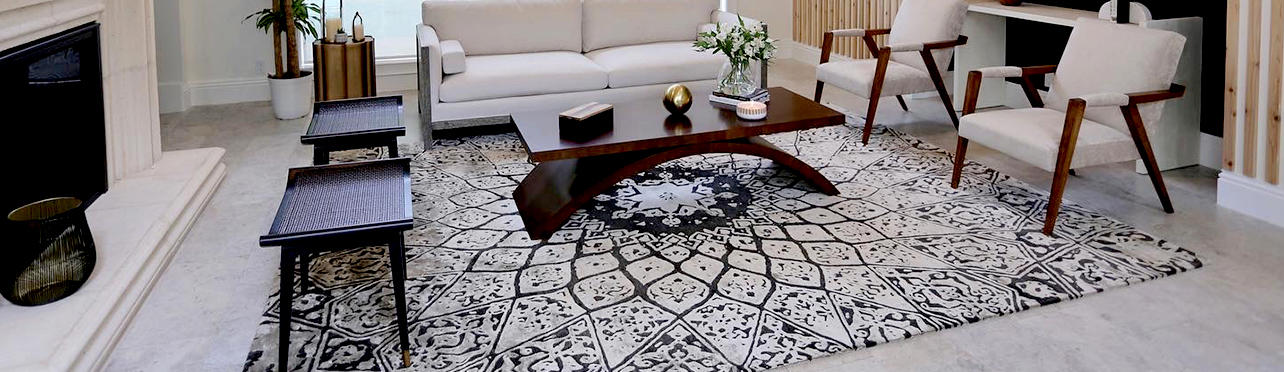
Locate an element on the screen. leftmost chair is located at coordinates click(x=312, y=202).